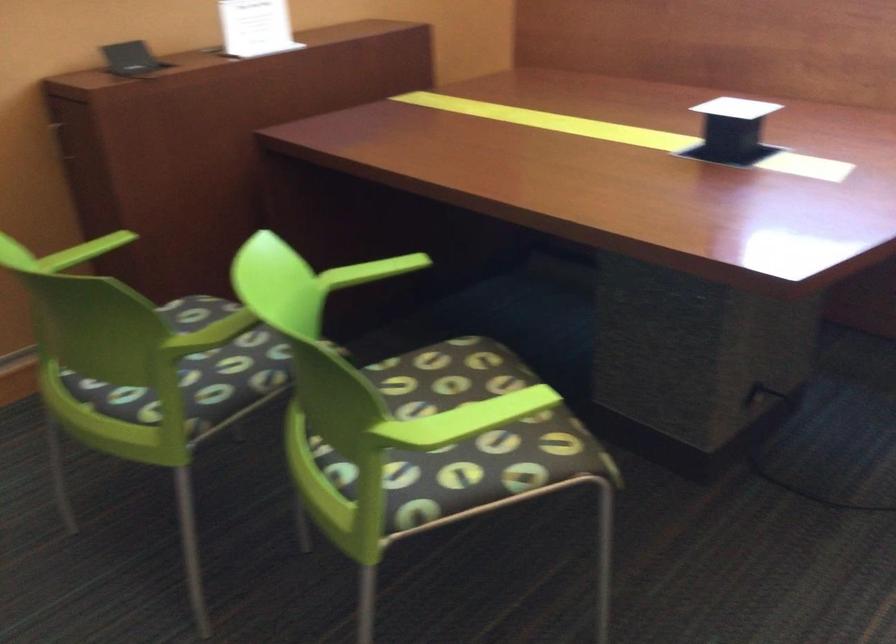
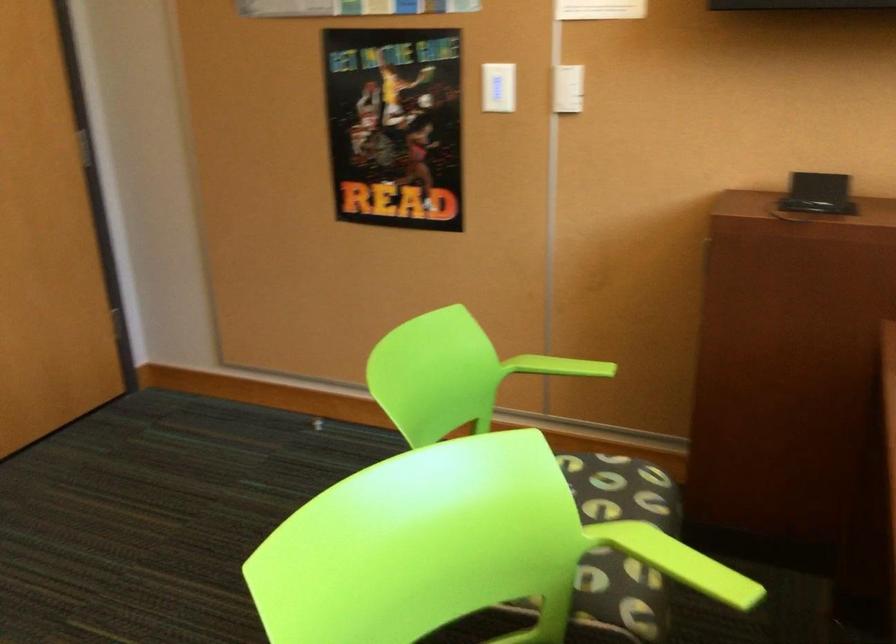
The point at [90,252] is marked in the first image. Where is the corresponding point in the second image?

(558, 366)